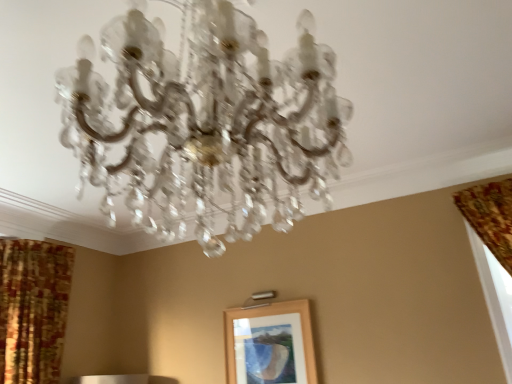
Question: From the image's perspective, is clear crystal chandelier at center on top of wooden picture frame at center?

Choices:
 (A) yes
 (B) no

Answer: (A)

Question: Is wooden picture frame at center at the back of clear crystal chandelier at center?

Choices:
 (A) no
 (B) yes

Answer: (A)

Question: Does clear crystal chandelier at center have a smaller size compared to wooden picture frame at center?

Choices:
 (A) yes
 (B) no

Answer: (B)

Question: From a real-world perspective, does clear crystal chandelier at center stand above wooden picture frame at center?

Choices:
 (A) no
 (B) yes

Answer: (B)

Question: From a real-world perspective, is clear crystal chandelier at center below wooden picture frame at center?

Choices:
 (A) no
 (B) yes

Answer: (A)

Question: Is clear crystal chandelier at center taller than wooden picture frame at center?

Choices:
 (A) yes
 (B) no

Answer: (A)

Question: Is clear crystal chandelier at center not inside patterned fabric curtain at left?

Choices:
 (A) yes
 (B) no

Answer: (A)

Question: From the image's perspective, is clear crystal chandelier at center under patterned fabric curtain at left?

Choices:
 (A) no
 (B) yes

Answer: (A)

Question: Is clear crystal chandelier at center positioned in front of patterned fabric curtain at left?

Choices:
 (A) yes
 (B) no

Answer: (A)

Question: Is clear crystal chandelier at center looking in the opposite direction of patterned fabric curtain at left?

Choices:
 (A) yes
 (B) no

Answer: (B)

Question: Considering the relative positions of clear crystal chandelier at center and patterned fabric curtain at left in the image provided, is clear crystal chandelier at center behind patterned fabric curtain at left?

Choices:
 (A) yes
 (B) no

Answer: (B)

Question: Does clear crystal chandelier at center have a smaller size compared to patterned fabric curtain at left?

Choices:
 (A) yes
 (B) no

Answer: (A)

Question: Does patterned fabric curtain at left contain clear crystal chandelier at center?

Choices:
 (A) no
 (B) yes

Answer: (A)